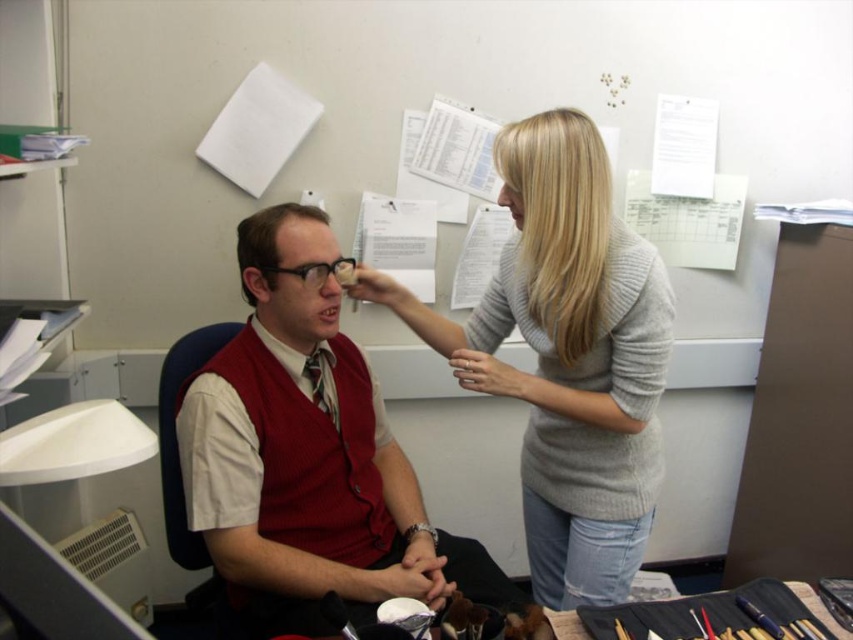
Describe the element at coordinates (566, 356) in the screenshot. I see `light gray sweater at upper right` at that location.

Based on the photo, does light gray sweater at upper right have a larger size compared to matte black forehead at center?

Yes, light gray sweater at upper right is bigger than matte black forehead at center.

Between point (531, 300) and point (276, 257), which one is positioned in front?

Point (276, 257) is more forward.

Where is `light gray sweater at upper right`? light gray sweater at upper right is located at coordinates (566, 356).

Is matte red vest at center in front of matte black forehead at center?

Yes, it is.

Which is more to the left, matte red vest at center or matte black forehead at center?

matte black forehead at center is more to the left.

Which is behind, point (276, 221) or point (323, 244)?

The point (323, 244) is behind.

Where is `matte red vest at center`? This screenshot has width=853, height=640. matte red vest at center is located at coordinates (308, 461).

Does matte red vest at center come behind light gray sweater at upper right?

No, matte red vest at center is in front of light gray sweater at upper right.

Is matte red vest at center below light gray sweater at upper right?

Yes, matte red vest at center is below light gray sweater at upper right.

Is point (282, 483) farther from viewer compared to point (653, 266)?

Yes, it is behind point (653, 266).

Find the location of a particular element. The image size is (853, 640). matte red vest at center is located at coordinates (308, 461).